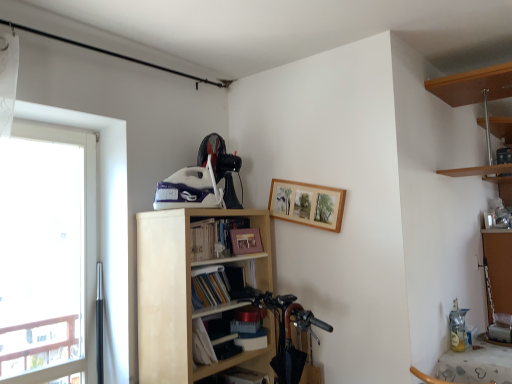
Question: Is light wood bookshelf at center inside matte paper book at center, the 2th book positioned from the top?

Choices:
 (A) no
 (B) yes

Answer: (A)

Question: Can you confirm if matte paper book at center, marked as the first book in a bottom-to-top arrangement, is positioned to the right of light wood bookshelf at center?

Choices:
 (A) no
 (B) yes

Answer: (B)

Question: Is matte paper book at center, marked as the first book in a bottom-to-top arrangement, to the left of light wood bookshelf at center from the viewer's perspective?

Choices:
 (A) no
 (B) yes

Answer: (A)

Question: Is matte paper book at center, the 2th book positioned from the top, wider than light wood bookshelf at center?

Choices:
 (A) no
 (B) yes

Answer: (A)

Question: Is matte paper book at center, the 2th book positioned from the top, in front of light wood bookshelf at center?

Choices:
 (A) yes
 (B) no

Answer: (B)

Question: From the image's perspective, would you say matte paper book at center, marked as the first book in a bottom-to-top arrangement, is shown under light wood bookshelf at center?

Choices:
 (A) yes
 (B) no

Answer: (B)

Question: Considering the relative sizes of shiny black mountain bike at lower center and hardcover book at center, which appears as the 1th book when viewed from the top, in the image provided, is shiny black mountain bike at lower center wider than hardcover book at center, which appears as the 1th book when viewed from the top,?

Choices:
 (A) yes
 (B) no

Answer: (B)

Question: Does shiny black mountain bike at lower center have a lesser height compared to hardcover book at center, which appears as the 1th book when viewed from the top?

Choices:
 (A) yes
 (B) no

Answer: (B)

Question: Could you tell me if shiny black mountain bike at lower center is turned towards hardcover book at center, which appears as the 1th book when viewed from the top?

Choices:
 (A) no
 (B) yes

Answer: (A)

Question: From a real-world perspective, is shiny black mountain bike at lower center positioned over hardcover book at center, the 2th book ordered from the bottom, based on gravity?

Choices:
 (A) yes
 (B) no

Answer: (B)

Question: Is the depth of shiny black mountain bike at lower center greater than that of hardcover book at center, which appears as the 1th book when viewed from the top?

Choices:
 (A) no
 (B) yes

Answer: (B)

Question: From the image's perspective, is shiny black mountain bike at lower center on top of hardcover book at center, the 2th book ordered from the bottom?

Choices:
 (A) yes
 (B) no

Answer: (B)

Question: Can you confirm if shiny black mountain bike at lower center is bigger than matte paper book at center, the 2th book positioned from the top?

Choices:
 (A) no
 (B) yes

Answer: (A)